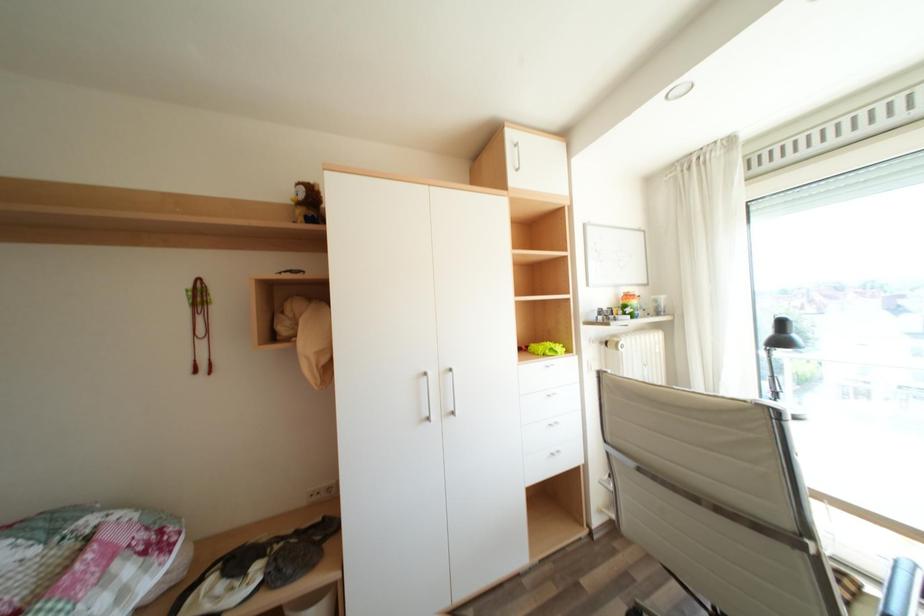
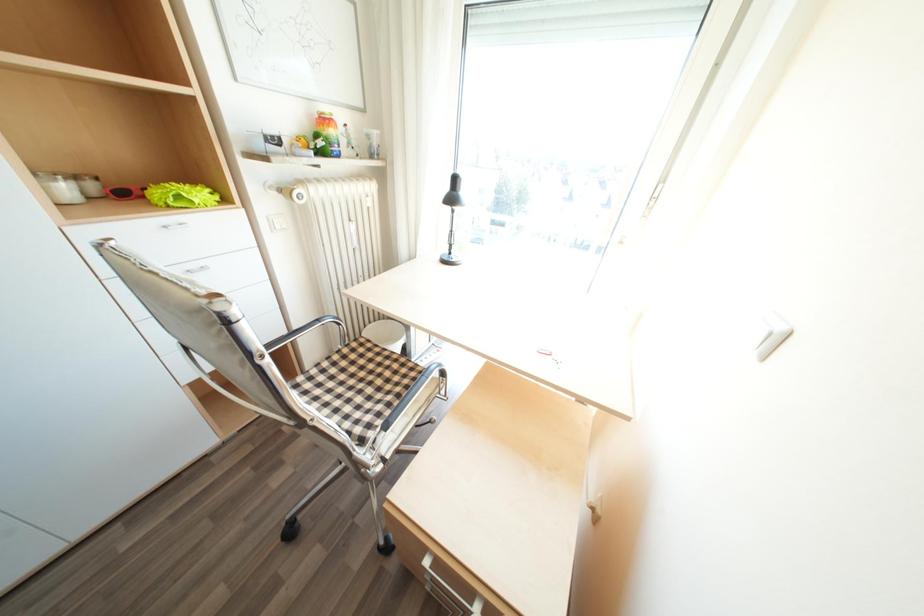
Based on the photo, the first image is from the beginning of the video and the second image is from the end. How did the camera likely rotate when shooting the video?

The camera rotated toward right-down.